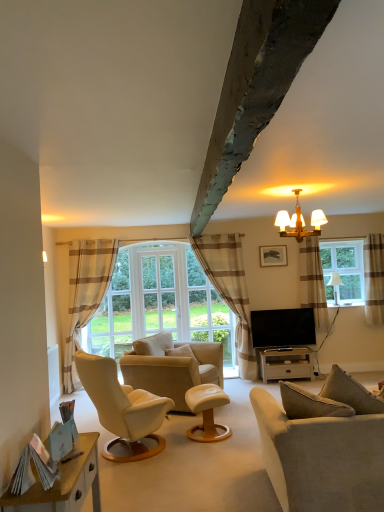
Question: Does beige striped curtain at left, arranged as the 1th curtain when viewed from the left, have a greater width compared to beige leather armchair at center?

Choices:
 (A) yes
 (B) no

Answer: (B)

Question: Can you confirm if beige striped curtain at left, placed as the fourth curtain when sorted from right to left, is positioned to the left of beige leather armchair at center?

Choices:
 (A) no
 (B) yes

Answer: (B)

Question: From a real-world perspective, is beige striped curtain at left, arranged as the 1th curtain when viewed from the left, located beneath beige leather armchair at center?

Choices:
 (A) no
 (B) yes

Answer: (A)

Question: Is beige striped curtain at left, arranged as the 1th curtain when viewed from the left, facing away from beige leather armchair at center?

Choices:
 (A) yes
 (B) no

Answer: (B)

Question: Could you tell me if beige striped curtain at left, placed as the fourth curtain when sorted from right to left, is turned towards beige leather armchair at center?

Choices:
 (A) no
 (B) yes

Answer: (A)

Question: From the image's perspective, relative to flat screen tv at center, is white glass window screen at center above or below?

Choices:
 (A) above
 (B) below

Answer: (A)

Question: Does point (144, 269) appear closer or farther from the camera than point (296, 325)?

Choices:
 (A) farther
 (B) closer

Answer: (B)

Question: Based on their sizes in the image, would you say white glass window screen at center is bigger or smaller than flat screen tv at center?

Choices:
 (A) big
 (B) small

Answer: (A)

Question: Visually, is white glass window screen at center positioned to the left or to the right of flat screen tv at center?

Choices:
 (A) right
 (B) left

Answer: (B)

Question: Looking at their shapes, would you say beige striped curtain at left, arranged as the 1th curtain when viewed from the left, is wider or thinner than light gray fabric couch at lower right?

Choices:
 (A) thin
 (B) wide

Answer: (A)

Question: From a real-world perspective, is beige striped curtain at left, arranged as the 1th curtain when viewed from the left, positioned above or below light gray fabric couch at lower right?

Choices:
 (A) below
 (B) above

Answer: (B)

Question: Choose the correct answer: Is beige striped curtain at left, arranged as the 1th curtain when viewed from the left, inside light gray fabric couch at lower right or outside it?

Choices:
 (A) outside
 (B) inside

Answer: (A)

Question: In terms of height, does beige striped curtain at left, arranged as the 1th curtain when viewed from the left, look taller or shorter compared to light gray fabric couch at lower right?

Choices:
 (A) tall
 (B) short

Answer: (A)

Question: Based on their sizes in the image, would you say white wood tv stand at lower right is bigger or smaller than clear glass window at right?

Choices:
 (A) small
 (B) big

Answer: (B)

Question: In terms of width, does white wood tv stand at lower right look wider or thinner when compared to clear glass window at right?

Choices:
 (A) wide
 (B) thin

Answer: (A)